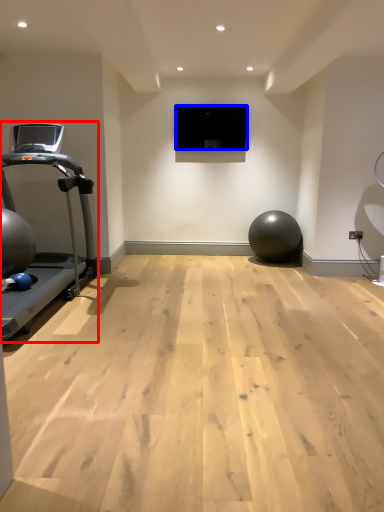
Question: Which of the following is the closest to the observer, treadmill (highlighted by a red box) or projection screen (highlighted by a blue box)?

Choices:
 (A) treadmill
 (B) projection screen

Answer: (A)